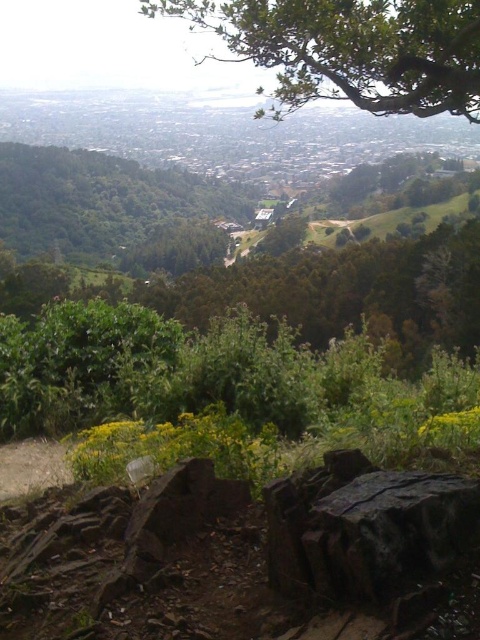
Find the location of a particular element. This screenshot has width=480, height=640. green leafy tree at upper center is located at coordinates (348, 49).

In the scene shown: Who is positioned more to the left, green leafy tree at upper center or green leafy tree at center?

Positioned to the left is green leafy tree at center.

Is point (294, 58) positioned behind point (133, 234)?

No.

The height and width of the screenshot is (640, 480). What are the coordinates of `green leafy tree at upper center` in the screenshot? It's located at (348, 49).